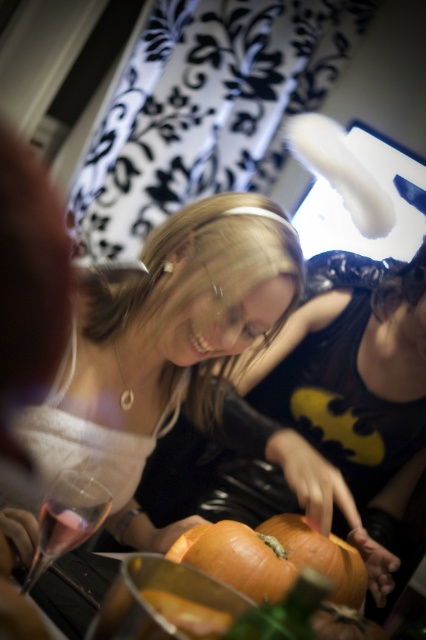
Question: Estimate the real-world distances between objects in this image. Which object is closer to the matte white hairband at center?

Choices:
 (A) clear glass wine glass at lower left
 (B) transparent glass at lower left

Answer: (A)

Question: Which object is the closest to the matte white hairband at center?

Choices:
 (A) clear glass wine glass at lower left
 (B) orange matte pumpkin at center

Answer: (B)

Question: Is orange matte pumpkin at center smaller than transparent glass at lower left?

Choices:
 (A) no
 (B) yes

Answer: (A)

Question: Which of these objects is positioned farthest from the clear glass wine glass at lower left?

Choices:
 (A) orange matte pumpkin at center
 (B) matte white hairband at center
 (C) transparent glass at lower left

Answer: (B)

Question: Observing the image, what is the correct spatial positioning of orange matte pumpkin at center in reference to clear glass wine glass at lower left?

Choices:
 (A) above
 (B) below

Answer: (B)

Question: Does matte white hairband at center appear on the left side of transparent glass at lower left?

Choices:
 (A) no
 (B) yes

Answer: (A)